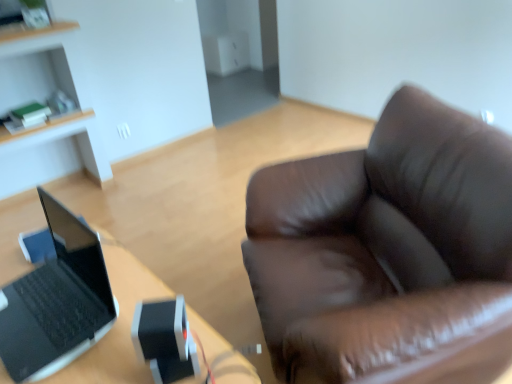
Question: Considering the relative sizes of black matte laptop at left and black plastic laptop at left in the image provided, is black matte laptop at left smaller than black plastic laptop at left?

Choices:
 (A) yes
 (B) no

Answer: (A)

Question: Considering the relative sizes of black matte laptop at left and black plastic laptop at left in the image provided, is black matte laptop at left shorter than black plastic laptop at left?

Choices:
 (A) no
 (B) yes

Answer: (B)

Question: Is black matte laptop at left at the left side of black plastic laptop at left?

Choices:
 (A) no
 (B) yes

Answer: (B)

Question: Can you confirm if black matte laptop at left is taller than black plastic laptop at left?

Choices:
 (A) no
 (B) yes

Answer: (A)

Question: Is black matte laptop at left oriented away from black plastic laptop at left?

Choices:
 (A) no
 (B) yes

Answer: (A)

Question: Is black plastic laptop at left spatially inside light wood cabinet at upper left, or outside of it?

Choices:
 (A) outside
 (B) inside

Answer: (A)

Question: From the image's perspective, relative to light wood cabinet at upper left, is black plastic laptop at left above or below?

Choices:
 (A) below
 (B) above

Answer: (A)

Question: Is point (58, 254) positioned closer to the camera than point (35, 39)?

Choices:
 (A) farther
 (B) closer

Answer: (B)

Question: Is black plastic laptop at left to the left or to the right of light wood cabinet at upper left in the image?

Choices:
 (A) right
 (B) left

Answer: (A)

Question: Is point (10, 87) closer or farther from the camera than point (50, 339)?

Choices:
 (A) closer
 (B) farther

Answer: (B)

Question: From a real-world perspective, is light wood cabinet at upper left above or below black plastic laptop at left?

Choices:
 (A) below
 (B) above

Answer: (B)

Question: Would you say light wood cabinet at upper left is to the left or to the right of black plastic laptop at left in the picture?

Choices:
 (A) left
 (B) right

Answer: (A)

Question: Relative to black plastic laptop at left, is light wood cabinet at upper left in front or behind?

Choices:
 (A) front
 (B) behind

Answer: (B)

Question: Is black matte laptop at left in front of or behind light wood cabinet at upper left in the image?

Choices:
 (A) behind
 (B) front

Answer: (B)

Question: From a real-world perspective, is black matte laptop at left above or below light wood cabinet at upper left?

Choices:
 (A) above
 (B) below

Answer: (A)